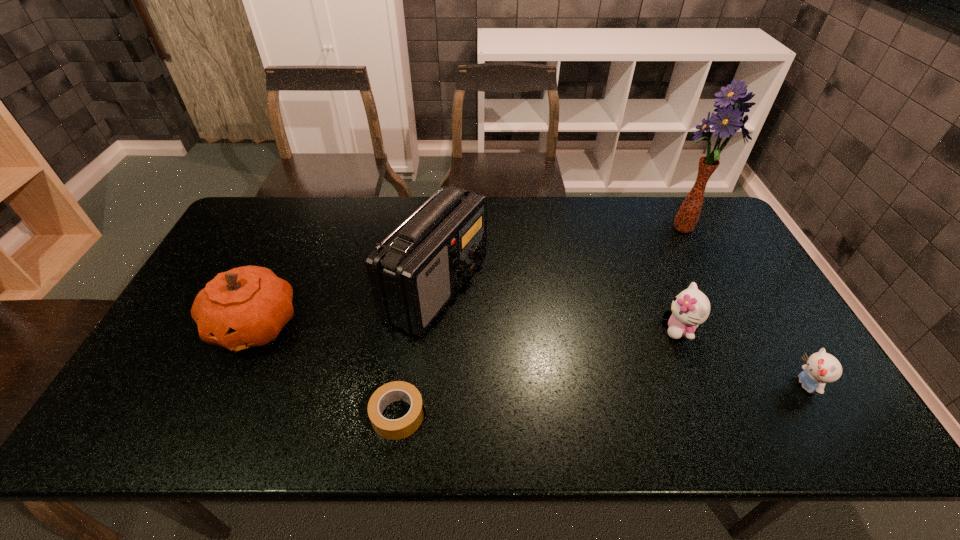
At what (x,y) coordinates should I click in order to perform the action: click on vacant space located on the front panel of the second tallest object. Please return your answer as a coordinate pair (x, y). Looking at the image, I should click on pos(602,288).

Locate an element on the screen. free space located 0.140m on the front-facing side of the pumpkin is located at coordinates click(x=214, y=415).

Locate an element on the screen. The width and height of the screenshot is (960, 540). free space located 0.060m on the front-facing side of the left kitten is located at coordinates (640, 328).

Where is `vacant space located 0.170m on the front-facing side of the left kitten`? vacant space located 0.170m on the front-facing side of the left kitten is located at coordinates (600, 328).

Locate an element on the screen. The image size is (960, 540). vacant space located 0.050m on the front-facing side of the left kitten is located at coordinates (644, 328).

Identify the location of vacant space located on the front-facing side of the shorter kitten. (768, 385).

Where is `free space located on the front-facing side of the shorter kitten`? free space located on the front-facing side of the shorter kitten is located at coordinates (768, 385).

The width and height of the screenshot is (960, 540). What are the coordinates of `free location located on the front-facing side of the shorter kitten` in the screenshot? It's located at (682, 385).

Find the location of a particular element. Image resolution: width=960 pixels, height=540 pixels. free spot located at the edge of the duct tape is located at coordinates (566, 415).

Identify the location of object located in the far edge section of the desktop. The image size is (960, 540). (729, 119).